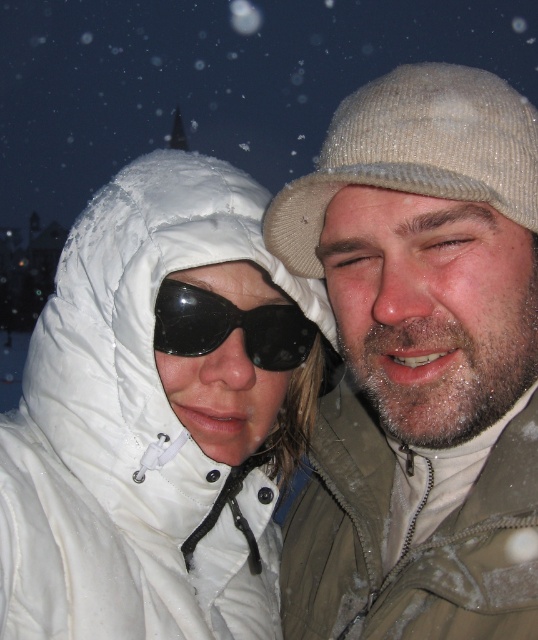
Can you confirm if fuzzy beige knit cap at upper right is positioned to the right of white puffy coat at center?

Correct, you'll find fuzzy beige knit cap at upper right to the right of white puffy coat at center.

From the picture: Can you confirm if fuzzy beige knit cap at upper right is taller than white puffy coat at center?

Indeed, fuzzy beige knit cap at upper right has a greater height compared to white puffy coat at center.

The image size is (538, 640). What do you see at coordinates (421, 362) in the screenshot?
I see `fuzzy beige knit cap at upper right` at bounding box center [421, 362].

You are a GUI agent. You are given a task and a screenshot of the screen. Output one action in this format:
    pyautogui.click(x=<x>, y=<y>)
    Task: Click on the fuzzy beige knit cap at upper right
    
    Given the screenshot: What is the action you would take?
    pyautogui.click(x=421, y=362)

Is fuzzy beige knit cap at upper right bigger than black matte sunglasses at center?

Correct, fuzzy beige knit cap at upper right is larger in size than black matte sunglasses at center.

The image size is (538, 640). Describe the element at coordinates (421, 362) in the screenshot. I see `fuzzy beige knit cap at upper right` at that location.

Where is `fuzzy beige knit cap at upper right`? fuzzy beige knit cap at upper right is located at coordinates (421, 362).

Which is above, white puffy coat at center or black matte sunglasses at center?

black matte sunglasses at center is higher up.

Does white puffy coat at center lie behind black matte sunglasses at center?

No, it is in front of black matte sunglasses at center.

Is point (242, 312) in front of point (300, 333)?

Yes, it is in front of point (300, 333).

Find the location of a particular element. The image size is (538, 640). white puffy coat at center is located at coordinates (159, 416).